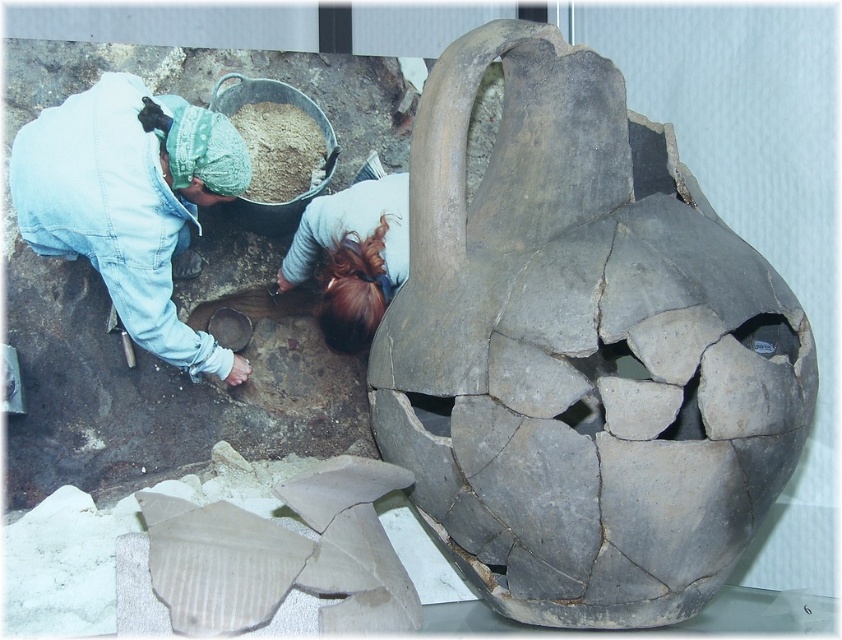
You are an archaeologist standing at the center of the excavation site. You notice the brown hair at lower center. Based on its position, can you determine if it is closer to the scattered ceramic fragments or the individual in the light blue jacket?

The brown hair at lower center is located at point [352,257]. Since the coordinates are closer to the lower center, it is closer to the scattered ceramic fragments than the individual in the light blue jacket.

You are an archaeologist working at the site. You need to place a protective cover over the denim jacket at lower left and the brown powder at center. Which object requires a larger cover?

The denim jacket at lower left requires a larger cover because it is bigger than the brown powder at center.